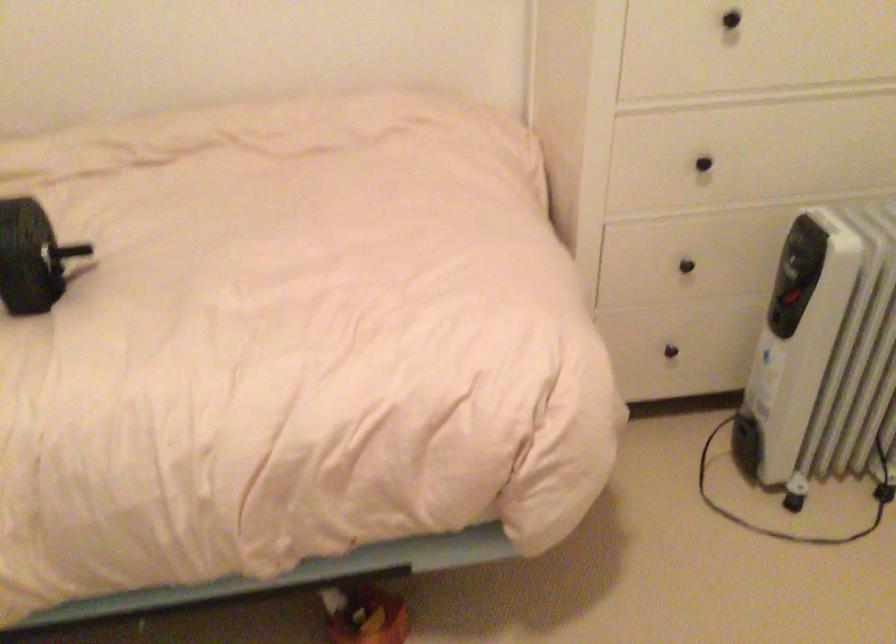
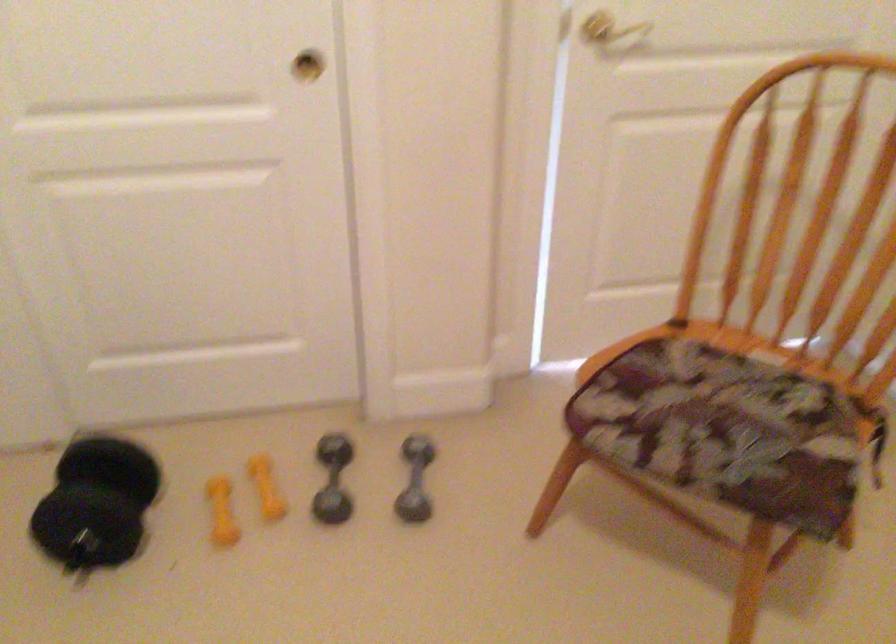
The first image is from the beginning of the video and the second image is from the end. How did the camera likely rotate when shooting the video?

The rotation direction of the camera is right-down.